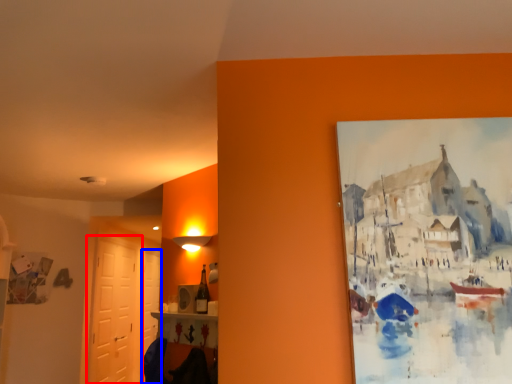
Question: Which of the following is the farthest to the observer, door (highlighted by a red box) or door (highlighted by a blue box)?

Choices:
 (A) door
 (B) door

Answer: (B)